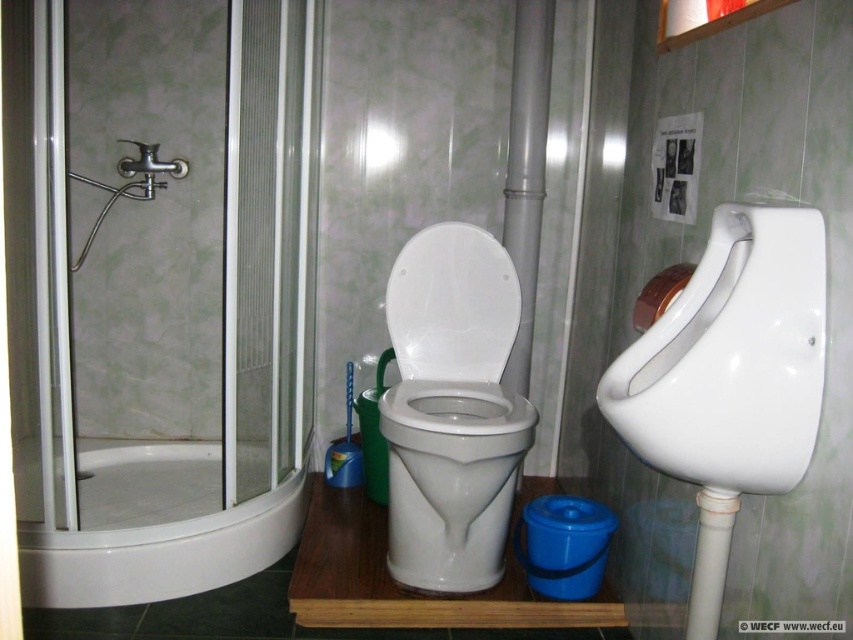
Question: Is white glossy urinal at right thinner than white glossy toilet bowl at center?

Choices:
 (A) yes
 (B) no

Answer: (A)

Question: Which of the following is the closest to the observer?

Choices:
 (A) brushed metal faucet at upper left
 (B) white glossy urinal at right

Answer: (B)

Question: Observing the image, what is the correct spatial positioning of white glossy bathtub at lower left in reference to brushed metal faucet at upper left?

Choices:
 (A) right
 (B) left

Answer: (A)

Question: Which object is farther from the camera taking this photo?

Choices:
 (A) white glossy urinal at right
 (B) white glossy bathtub at lower left

Answer: (B)

Question: Does white glossy urinal at right have a lesser width compared to white glossy bathtub at lower left?

Choices:
 (A) no
 (B) yes

Answer: (B)

Question: Among these points, which one is nearest to the camera?

Choices:
 (A) (158, 164)
 (B) (477, 310)

Answer: (B)